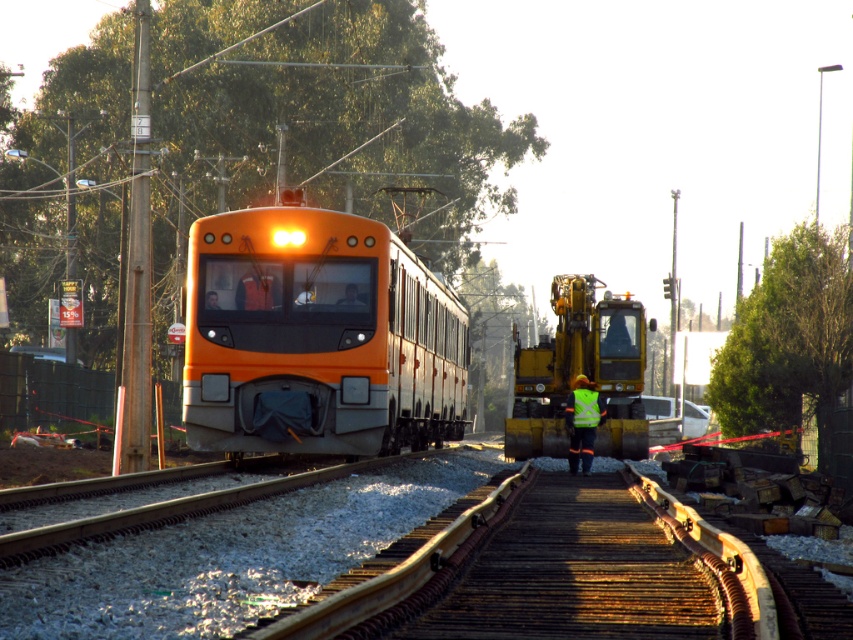
Question: Can you confirm if orange matte train at center is bigger than high visibility yellow vest at center?

Choices:
 (A) no
 (B) yes

Answer: (B)

Question: Among these objects, which one is farthest from the camera?

Choices:
 (A) high visibility yellow vest at center
 (B) orange matte train at center

Answer: (A)

Question: Is orange matte train at center bigger than high visibility yellow vest at center?

Choices:
 (A) yes
 (B) no

Answer: (A)

Question: Is orange matte train at center thinner than high visibility yellow vest at center?

Choices:
 (A) yes
 (B) no

Answer: (B)